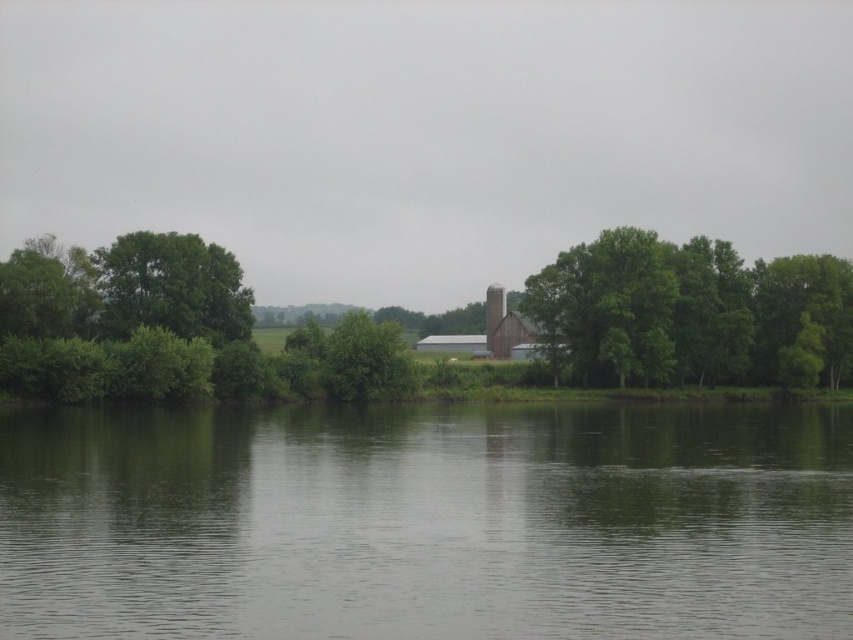
Question: Which point is farther from the camera taking this photo?

Choices:
 (A) [492, 624]
 (B) [761, 292]
 (C) [492, 344]

Answer: (C)

Question: Estimate the real-world distances between objects in this image. Which object is closer to the brown wooden chimney at center?

Choices:
 (A) green smooth water at lower center
 (B) green leafy tree at center

Answer: (B)

Question: Does green leafy tree at center appear under brown wooden chimney at center?

Choices:
 (A) yes
 (B) no

Answer: (A)

Question: Does green smooth water at lower center appear on the left side of green leafy tree at center?

Choices:
 (A) no
 (B) yes

Answer: (B)

Question: Which point is closer to the camera?

Choices:
 (A) green leafy tree at center
 (B) green smooth water at lower center
 (C) brown wooden chimney at center

Answer: (B)

Question: Can you confirm if green leafy tree at center is positioned above brown wooden chimney at center?

Choices:
 (A) yes
 (B) no

Answer: (B)